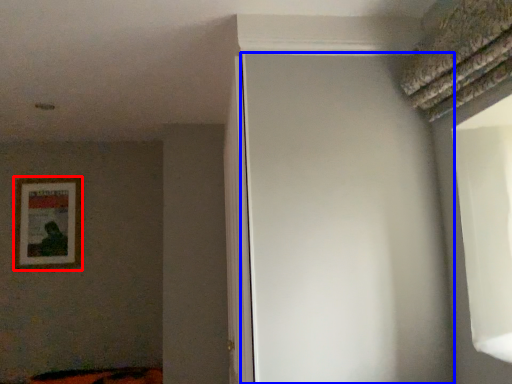
Question: Which object is further to the camera taking this photo, picture frame (highlighted by a red box) or screen door (highlighted by a blue box)?

Choices:
 (A) picture frame
 (B) screen door

Answer: (A)